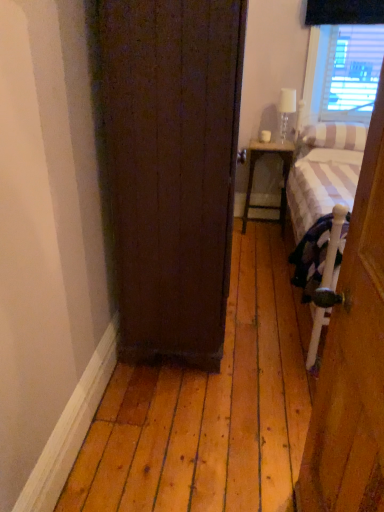
The image size is (384, 512). I want to click on free location in front of dark wood door at center, the 1th door in the back-to-front sequence, so 201,414.